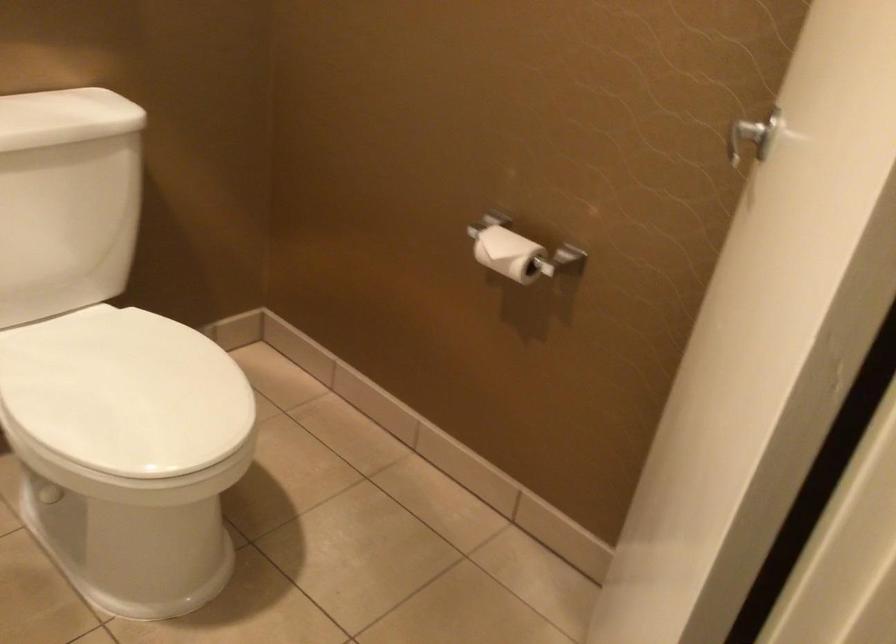
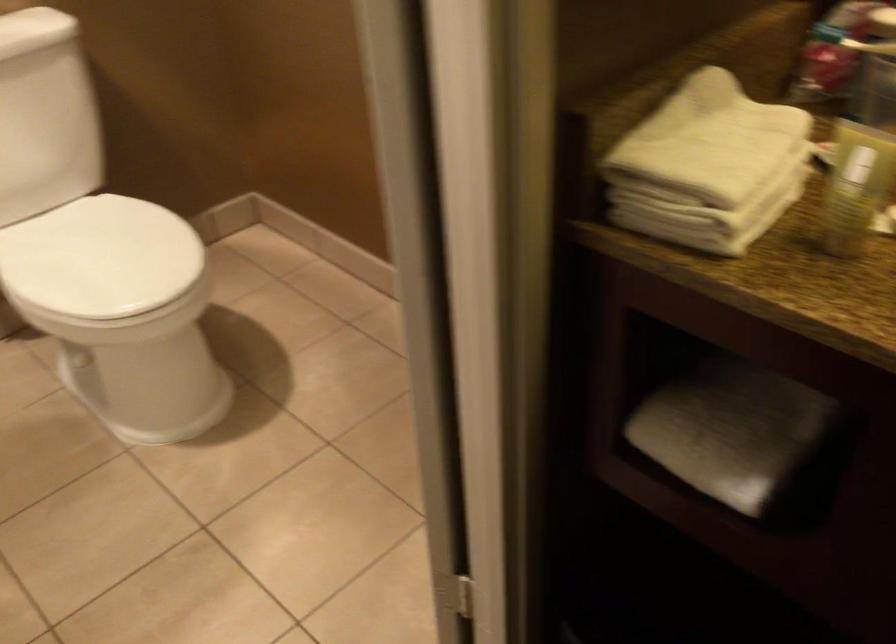
Question: I am providing you with two images of the same scene from different viewpoints. After the viewpoint changes to image2, which objects are now occluded?

Choices:
 (A) black slipper
 (B) white toilet lid
 (C) yellow lotion bottle
 (D) toilet paper roll

Answer: (D)